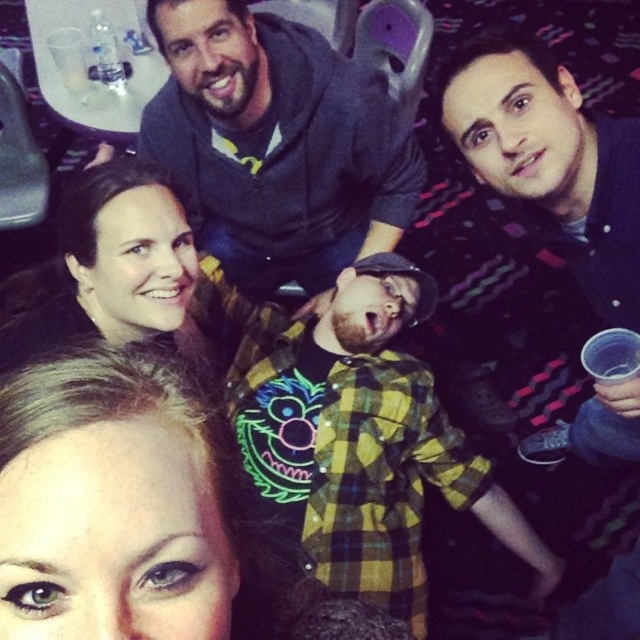
Who is positioned more to the right, yellow plaid shirt at center or matte gray hoodie at upper center?

From the viewer's perspective, yellow plaid shirt at center appears more on the right side.

Can you confirm if yellow plaid shirt at center is positioned above matte gray hoodie at upper center?

No, yellow plaid shirt at center is not above matte gray hoodie at upper center.

What do you see at coordinates (362, 436) in the screenshot? I see `yellow plaid shirt at center` at bounding box center [362, 436].

Locate an element on the screen. This screenshot has height=640, width=640. yellow plaid shirt at center is located at coordinates (362, 436).

Who is shorter, matte gray hoodie at upper center or matte black hair at upper left?

matte black hair at upper left is shorter.

Can you confirm if matte gray hoodie at upper center is positioned above matte black hair at upper left?

Correct, matte gray hoodie at upper center is located above matte black hair at upper left.

Is point (198, 140) farther from camera compared to point (150, 204)?

Yes.

Locate an element on the screen. Image resolution: width=640 pixels, height=640 pixels. matte gray hoodie at upper center is located at coordinates (276, 132).

This screenshot has width=640, height=640. In order to click on yellow plaid shirt at center in this screenshot , I will do `click(362, 436)`.

The image size is (640, 640). Find the location of `yellow plaid shirt at center`. yellow plaid shirt at center is located at coordinates (362, 436).

The height and width of the screenshot is (640, 640). Identify the location of yellow plaid shirt at center. (362, 436).